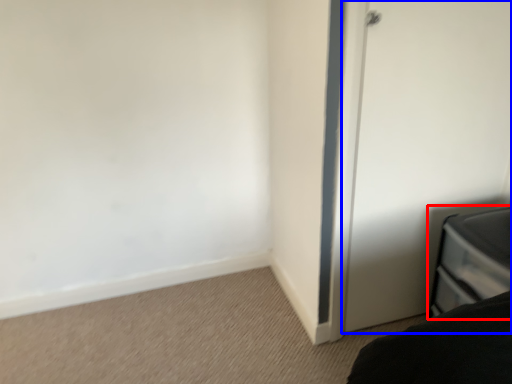
Question: Which object appears farthest to the camera in this image, furniture (highlighted by a red box) or door (highlighted by a blue box)?

Choices:
 (A) furniture
 (B) door

Answer: (B)